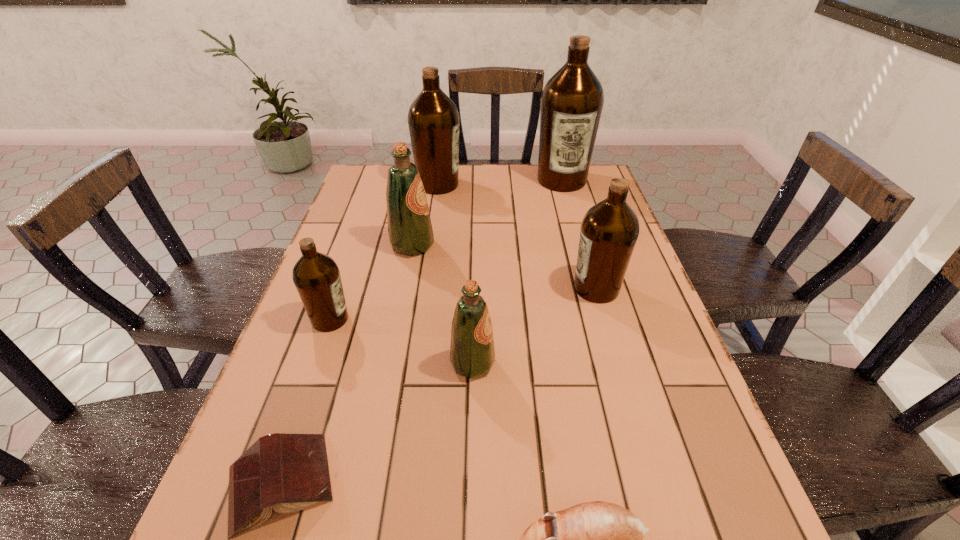
In order to click on object that is at the far right corner in this screenshot , I will do `click(572, 100)`.

In the image, there is a desktop. In order to click on vacant space at the far edge in this screenshot , I will do click(x=486, y=164).

The image size is (960, 540). I want to click on vacant region at the left edge of the desktop, so click(x=296, y=339).

The width and height of the screenshot is (960, 540). Find the location of `free space at the right edge`. free space at the right edge is located at coordinates (659, 372).

Locate an element on the screen. The width and height of the screenshot is (960, 540). vacant region at the far left corner of the desktop is located at coordinates (386, 177).

At what (x,y) coordinates should I click in order to perform the action: click on free area in between the second biggest brown olive oil and the biggest brown olive oil. Please return your answer as a coordinate pair (x, y). The height and width of the screenshot is (540, 960). Looking at the image, I should click on (500, 183).

Find the location of a particular element. vacant area that lies between the third olive oil from right to left and the smallest brown olive oil is located at coordinates (401, 341).

Where is `free space between the second brown olive oil from left to right and the right green olive oil`? This screenshot has height=540, width=960. free space between the second brown olive oil from left to right and the right green olive oil is located at coordinates (455, 274).

Locate an element on the screen. The image size is (960, 540). vacant space that is in between the biggest brown olive oil and the third biggest brown olive oil is located at coordinates (579, 234).

Where is `empty space between the second smallest brown olive oil and the biggest brown olive oil`? This screenshot has height=540, width=960. empty space between the second smallest brown olive oil and the biggest brown olive oil is located at coordinates (579, 234).